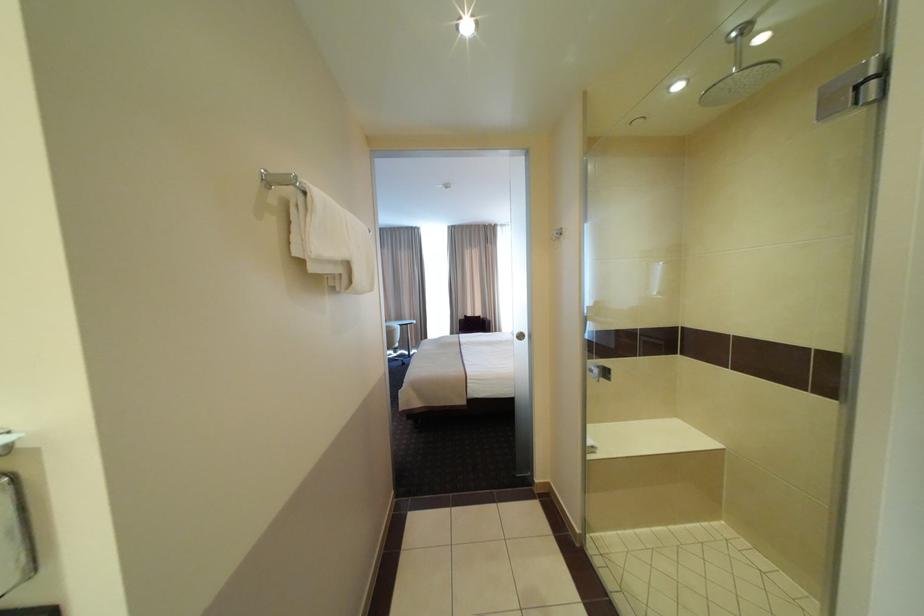
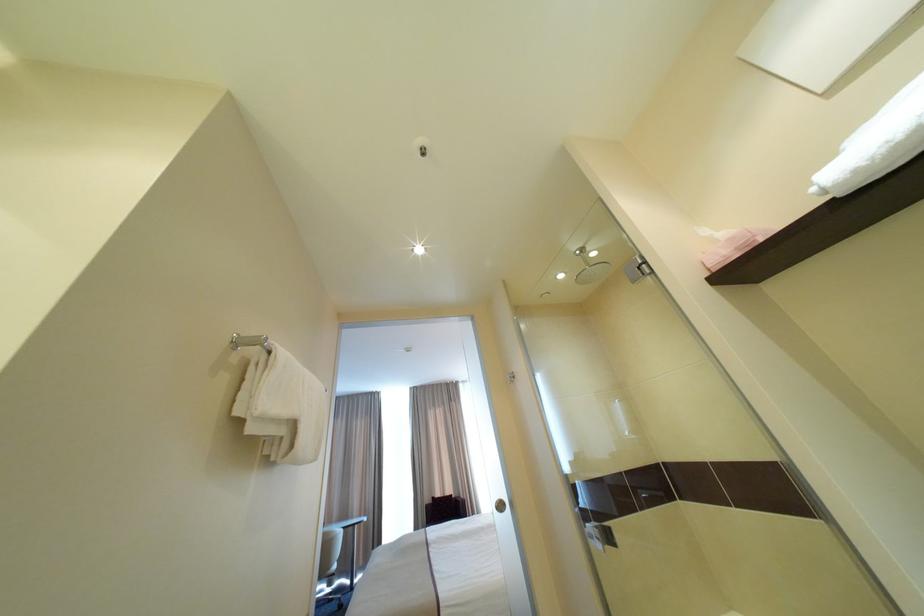
Question: The first image is from the beginning of the video and the second image is from the end. How did the camera likely rotate when shooting the video?

Choices:
 (A) Left
 (B) Right
 (C) Up
 (D) Down

Answer: (C)